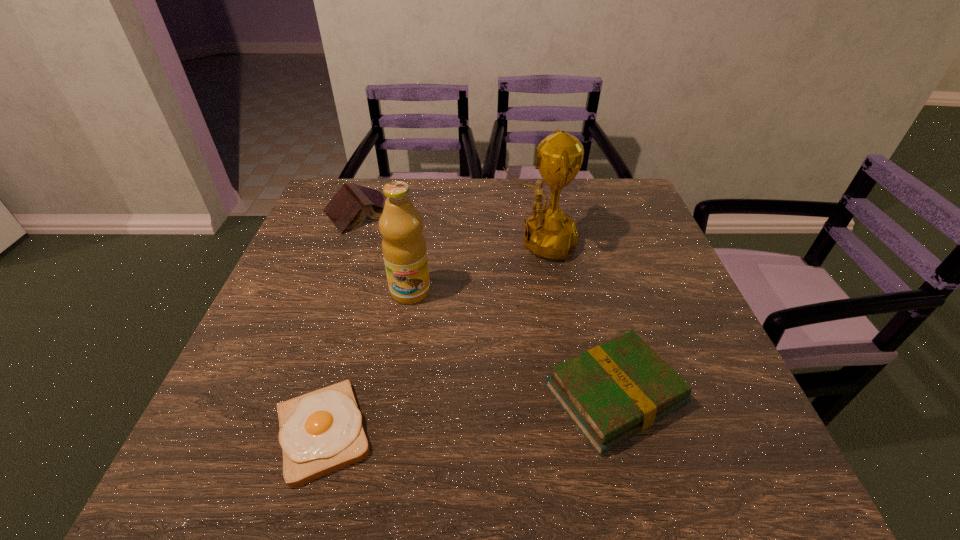
In order to click on award in this screenshot , I will do `click(549, 233)`.

What are the coordinates of `the third farthest object` in the screenshot? It's located at (404, 249).

The width and height of the screenshot is (960, 540). I want to click on the farther book, so click(x=347, y=209).

Image resolution: width=960 pixels, height=540 pixels. Identify the location of the nearer book. (611, 392).

The width and height of the screenshot is (960, 540). I want to click on toast, so click(x=320, y=432).

Identify the location of vacant space situated on the front side of the award. This screenshot has height=540, width=960. (377, 242).

What are the coordinates of `vacant region located on the front side of the award` in the screenshot? It's located at (419, 242).

The image size is (960, 540). What are the coordinates of `free point located 0.190m on the front side of the award` in the screenshot? It's located at (429, 242).

Find the location of `vacant space located 0.110m on the label of the third nearest object`. vacant space located 0.110m on the label of the third nearest object is located at coordinates (401, 344).

The height and width of the screenshot is (540, 960). I want to click on vacant space located 0.380m on the front of the farther book, so click(x=315, y=344).